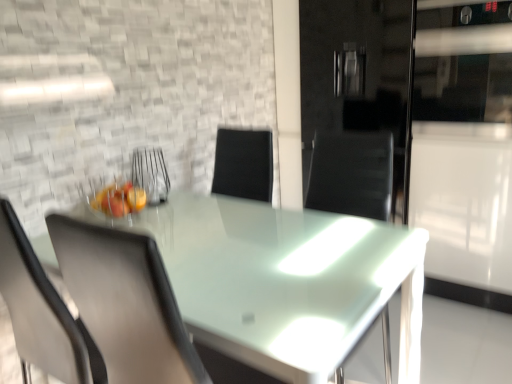
Question: Does matte gray chair at left have a greater height compared to transparent glass table at center?

Choices:
 (A) yes
 (B) no

Answer: (A)

Question: From the image's perspective, does matte gray chair at left appear higher than transparent glass table at center?

Choices:
 (A) no
 (B) yes

Answer: (B)

Question: Does matte gray chair at left have a larger size compared to transparent glass table at center?

Choices:
 (A) yes
 (B) no

Answer: (B)

Question: Is matte gray chair at left shorter than transparent glass table at center?

Choices:
 (A) yes
 (B) no

Answer: (B)

Question: Can you confirm if matte gray chair at left is positioned to the right of transparent glass table at center?

Choices:
 (A) yes
 (B) no

Answer: (B)

Question: From a real-world perspective, is transparent glass table at center above or below matte gray chair at left?

Choices:
 (A) above
 (B) below

Answer: (B)

Question: Is transparent glass table at center situated inside matte gray chair at left or outside?

Choices:
 (A) outside
 (B) inside

Answer: (A)

Question: In terms of height, does transparent glass table at center look taller or shorter compared to matte gray chair at left?

Choices:
 (A) short
 (B) tall

Answer: (A)

Question: From the image's perspective, is transparent glass table at center above or below matte gray chair at left?

Choices:
 (A) above
 (B) below

Answer: (B)

Question: Is matte gray chair at left in front of or behind metallic wire basket at center in the image?

Choices:
 (A) behind
 (B) front

Answer: (B)

Question: Considering the positions of matte gray chair at left and metallic wire basket at center in the image, is matte gray chair at left taller or shorter than metallic wire basket at center?

Choices:
 (A) short
 (B) tall

Answer: (B)

Question: Is point (68, 251) positioned closer to the camera than point (138, 152)?

Choices:
 (A) closer
 (B) farther

Answer: (A)

Question: In terms of width, does matte gray chair at left look wider or thinner when compared to metallic wire basket at center?

Choices:
 (A) thin
 (B) wide

Answer: (B)

Question: Would you say transparent glass table at center is to the left or to the right of metallic wire basket at center in the picture?

Choices:
 (A) left
 (B) right

Answer: (B)

Question: From their relative heights in the image, would you say transparent glass table at center is taller or shorter than metallic wire basket at center?

Choices:
 (A) short
 (B) tall

Answer: (B)